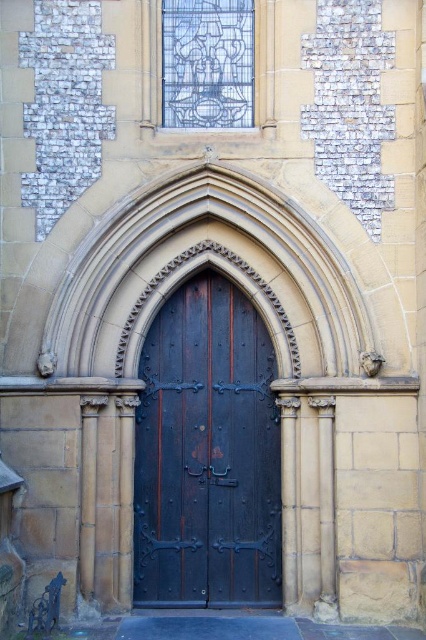
Question: In this image, where is dark wood door at center located relative to blue stained glass at upper center?

Choices:
 (A) right
 (B) left

Answer: (A)

Question: Which object is farther from the camera taking this photo?

Choices:
 (A) blue stained glass at upper center
 (B) dark wood door at center

Answer: (B)

Question: In this image, where is dark wood door at center located relative to blue stained glass at upper center?

Choices:
 (A) above
 (B) below

Answer: (B)

Question: Is dark wood door at center positioned before blue stained glass at upper center?

Choices:
 (A) no
 (B) yes

Answer: (A)

Question: Which point is farther to the camera?

Choices:
 (A) dark wood door at center
 (B) blue stained glass at upper center

Answer: (A)